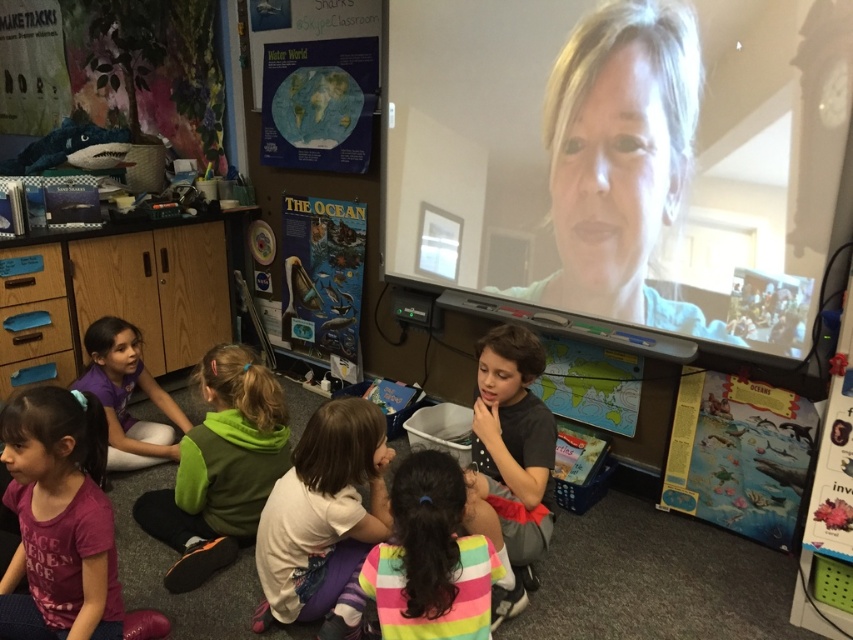
You are a student in the classroom looking at the screen. Which object is positioned higher between the blonde hair at upper center and the white soft shirt at center?

The blonde hair at upper center is positioned higher than the white soft shirt at center.